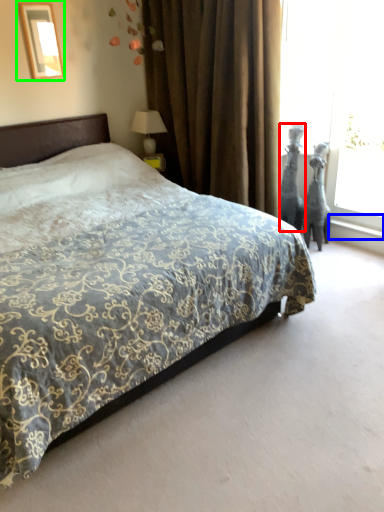
Question: Which object is the closest to the sculpture (highlighted by a red box)? Choose among these: window sill (highlighted by a blue box) or picture frame (highlighted by a green box).

Choices:
 (A) window sill
 (B) picture frame

Answer: (A)